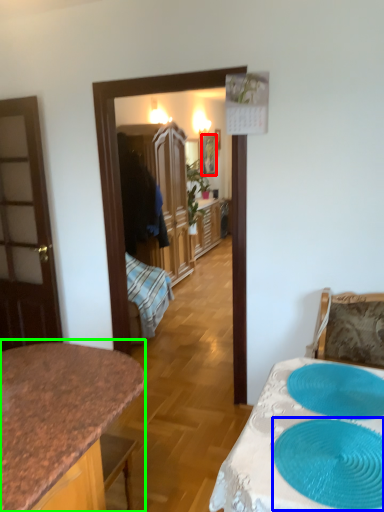
Question: Considering the real-world distances, which object is farthest from picture frame (highlighted by a red box)? oval (highlighted by a blue box) or countertop (highlighted by a green box)?

Choices:
 (A) oval
 (B) countertop

Answer: (A)